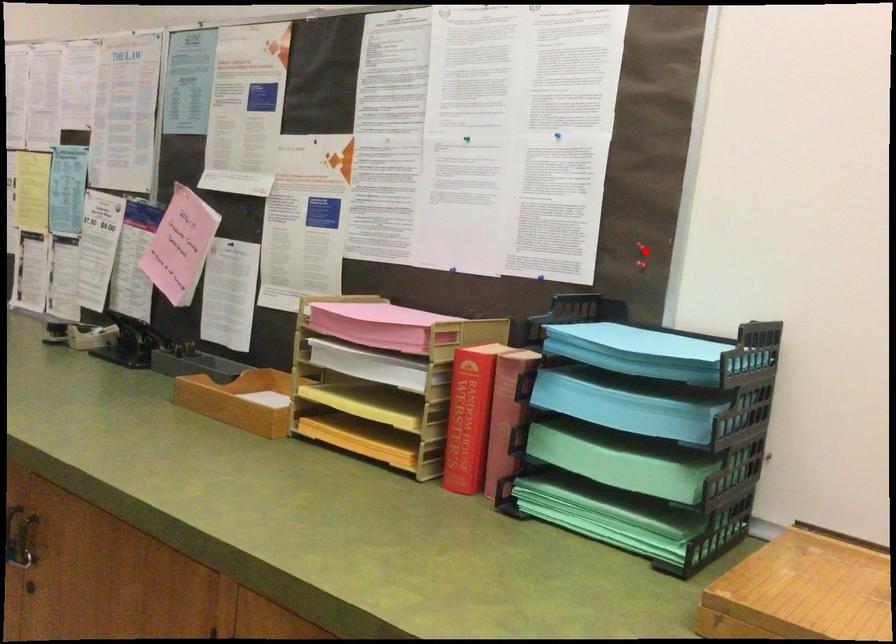
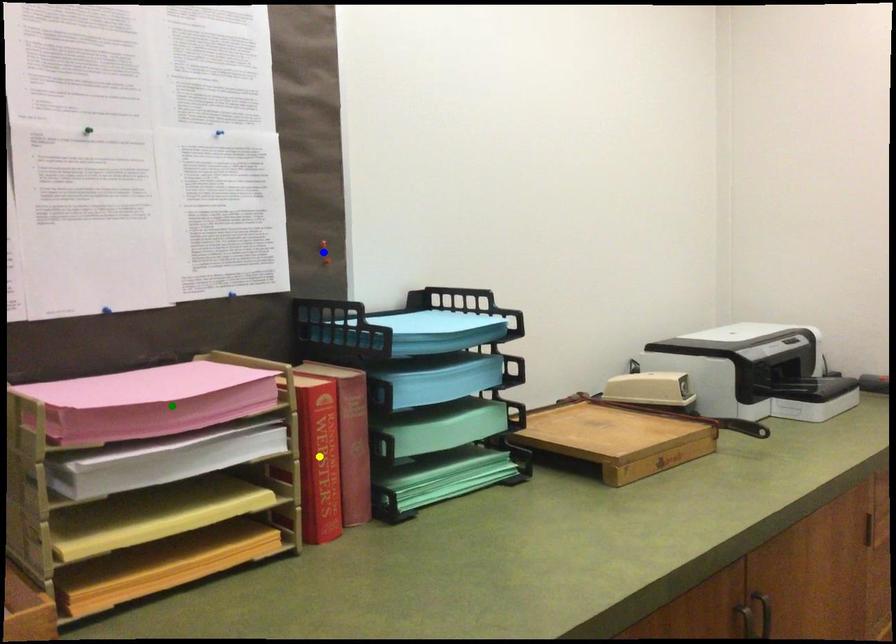
Question: I am providing you with two images of the same scene from different viewpoints. A red point is marked on the first image. You are given multiple points on the second image. Which mark in image 2 goes with the point in image 1?

Choices:
 (A) green point
 (B) blue point
 (C) yellow point

Answer: (B)